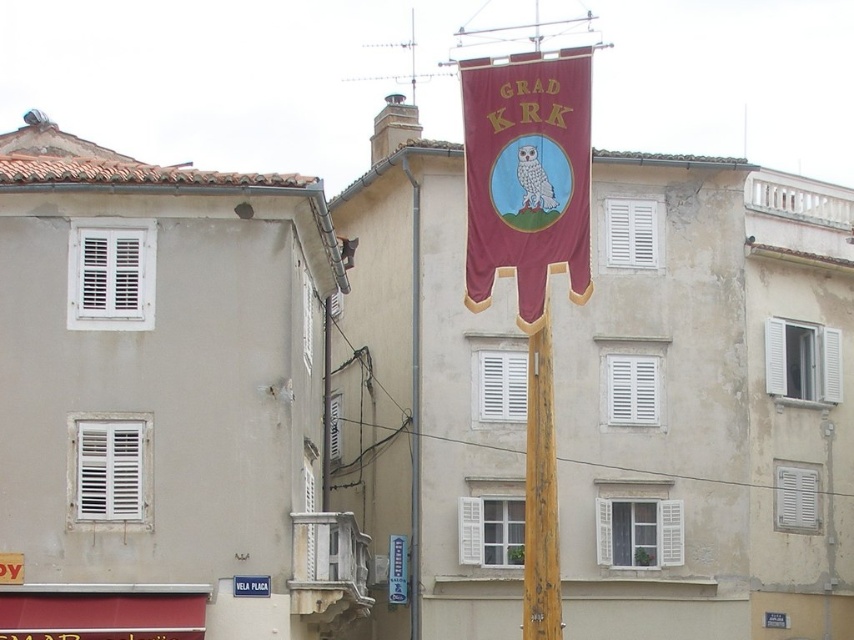
Question: Does wooden pole at center appear over white plastic street sign at center?

Choices:
 (A) yes
 (B) no

Answer: (A)

Question: Which object appears farthest from the camera in this image?

Choices:
 (A) wooden pole at center
 (B) maroon fabric banner at center
 (C) white plastic street sign at center

Answer: (C)

Question: Which point appears closest to the camera in this image?

Choices:
 (A) (401, 548)
 (B) (560, 83)
 (C) (537, 422)

Answer: (C)

Question: Which point is farther to the camera?

Choices:
 (A) maroon fabric banner at center
 (B) wooden pole at center
 (C) white plastic street sign at center

Answer: (C)

Question: Is maroon fabric banner at center above wooden pole at center?

Choices:
 (A) no
 (B) yes

Answer: (B)

Question: Considering the relative positions of maroon fabric banner at center and white plastic street sign at center in the image provided, where is maroon fabric banner at center located with respect to white plastic street sign at center?

Choices:
 (A) below
 (B) above

Answer: (B)